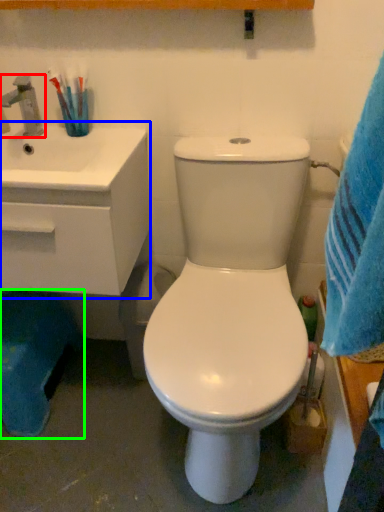
Question: Which is farther away from tap (highlighted by a red box)? counter top (highlighted by a blue box) or potty (highlighted by a green box)?

Choices:
 (A) counter top
 (B) potty

Answer: (B)